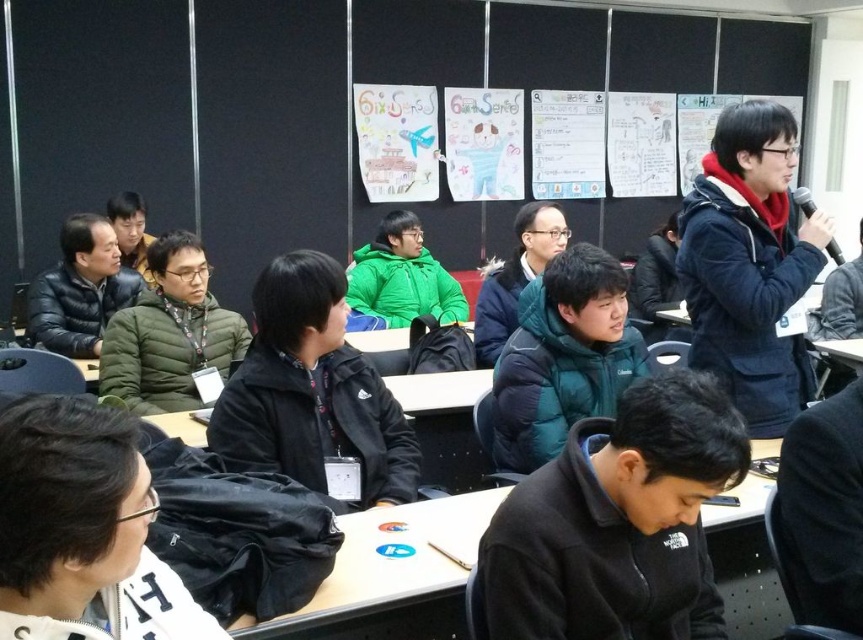
Who is lower down, black matte jacket at center or green matte jacket at center?

Positioned lower is black matte jacket at center.

Looking at this image, can you confirm if black matte jacket at center is shorter than green matte jacket at center?

Indeed, black matte jacket at center has a lesser height compared to green matte jacket at center.

Locate an element on the screen. black matte jacket at center is located at coordinates (312, 390).

Locate an element on the screen. This screenshot has height=640, width=863. black matte jacket at center is located at coordinates point(312,390).

Where is `blue denim jacket at upper right`? blue denim jacket at upper right is located at coordinates (748, 264).

Is point (772, 163) farther from viewer compared to point (482, 332)?

That is False.

This screenshot has width=863, height=640. What do you see at coordinates (748, 264) in the screenshot?
I see `blue denim jacket at upper right` at bounding box center [748, 264].

Find the location of `blue denim jacket at upper right`. blue denim jacket at upper right is located at coordinates (748, 264).

Which is behind, point (370, 461) or point (101, 218)?

The point (101, 218) is more distant.

From the picture: Does black matte jacket at center have a larger size compared to black fuzzy jacket at upper left?

Actually, black matte jacket at center might be smaller than black fuzzy jacket at upper left.

What do you see at coordinates (312, 390) in the screenshot? I see `black matte jacket at center` at bounding box center [312, 390].

I want to click on black matte jacket at center, so click(x=312, y=390).